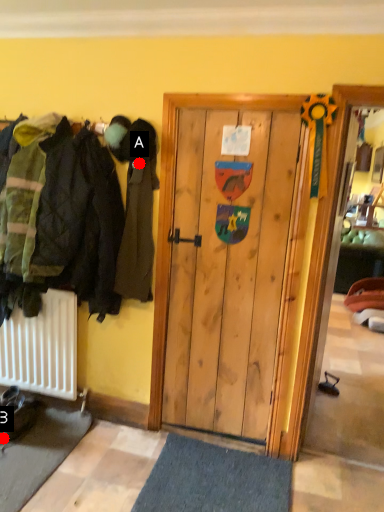
Question: Two points are circled on the image, labeled by A and B beside each circle. Among these points, which one is nearest to the camera?

Choices:
 (A) A is closer
 (B) B is closer

Answer: (A)